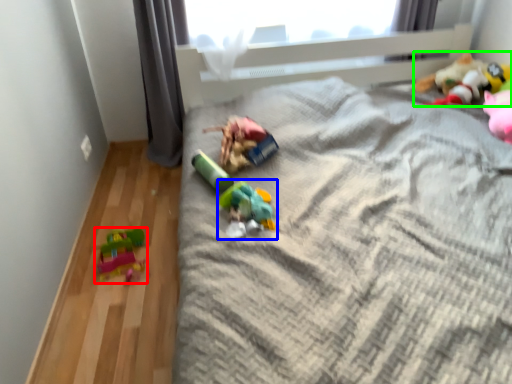
Question: Which object is the closest to the toy (highlighted by a red box)? Choose among these: toy (highlighted by a blue box) or toy (highlighted by a green box).

Choices:
 (A) toy
 (B) toy

Answer: (A)